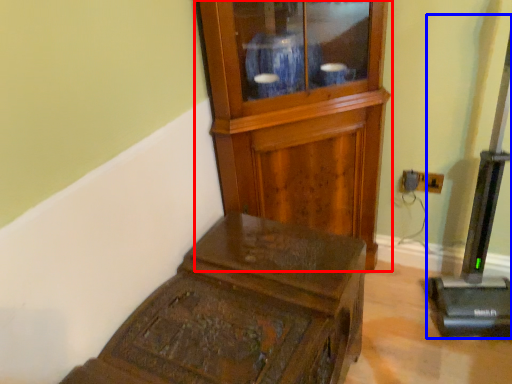
Question: Among these objects, which one is nearest to the camera, side cabinet (highlighted by a red box) or equipment (highlighted by a blue box)?

Choices:
 (A) side cabinet
 (B) equipment

Answer: (B)